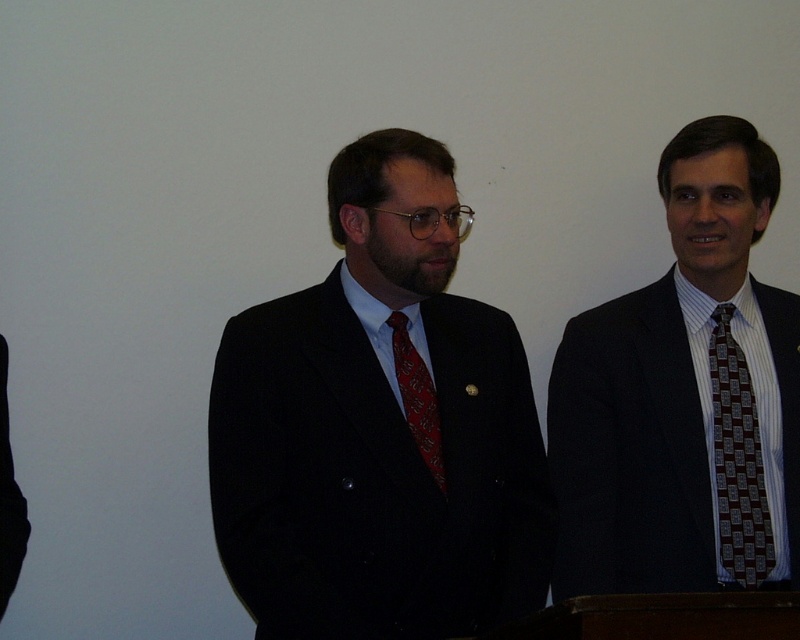
Which is behind, point (754, 456) or point (428, 436)?

The point (754, 456) is behind.

Does brown patterned tie at right have a greater height compared to red silk tie at center?

Yes.

Is point (713, 396) positioned after point (412, 355)?

Yes, point (713, 396) is farther from viewer.

At what (x,y) coordinates should I click in order to perform the action: click on brown patterned tie at right. Please return your answer as a coordinate pair (x, y). Looking at the image, I should click on (737, 460).

Where is `matte black suit at center`? The image size is (800, 640). matte black suit at center is located at coordinates (380, 428).

Can you confirm if matte black suit at center is smaller than red silk tie at center?

Incorrect, matte black suit at center is not smaller in size than red silk tie at center.

The width and height of the screenshot is (800, 640). What do you see at coordinates (380, 428) in the screenshot?
I see `matte black suit at center` at bounding box center [380, 428].

Where is `matte black suit at center`? matte black suit at center is located at coordinates (380, 428).

Does matte black suit at center appear on the right side of brown patterned tie at right?

No, matte black suit at center is not to the right of brown patterned tie at right.

Which is below, matte black suit at center or brown patterned tie at right?

brown patterned tie at right

Measure the distance between matte black suit at center and camera.

They are 5.14 feet apart.

The height and width of the screenshot is (640, 800). I want to click on matte black suit at center, so click(x=380, y=428).